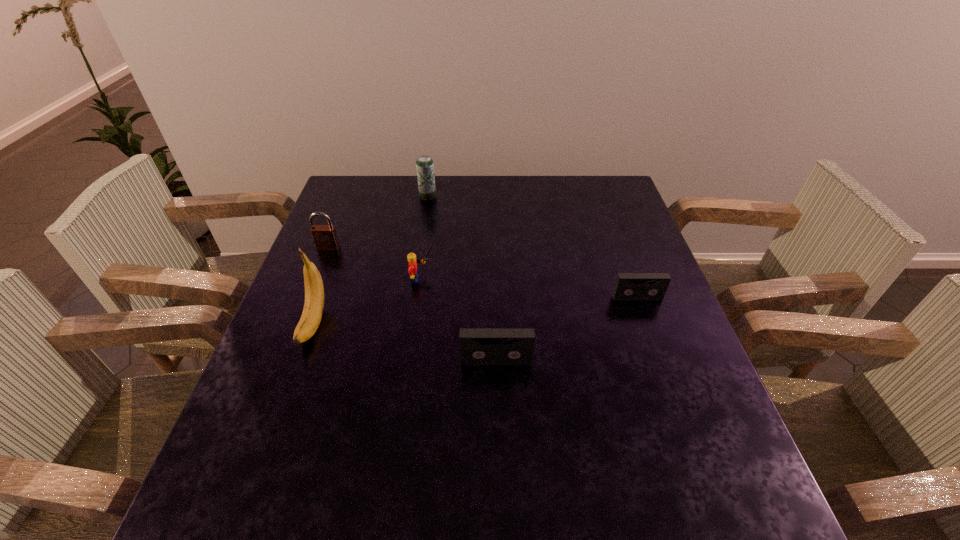
Please point a spot to add another videotape on the left. Please provide its 2D coordinates. Your answer should be formatted as a tuple, i.e. [(x, y)], where the tuple contains the x and y coordinates of a point satisfying the conditions above.

[(307, 446)]